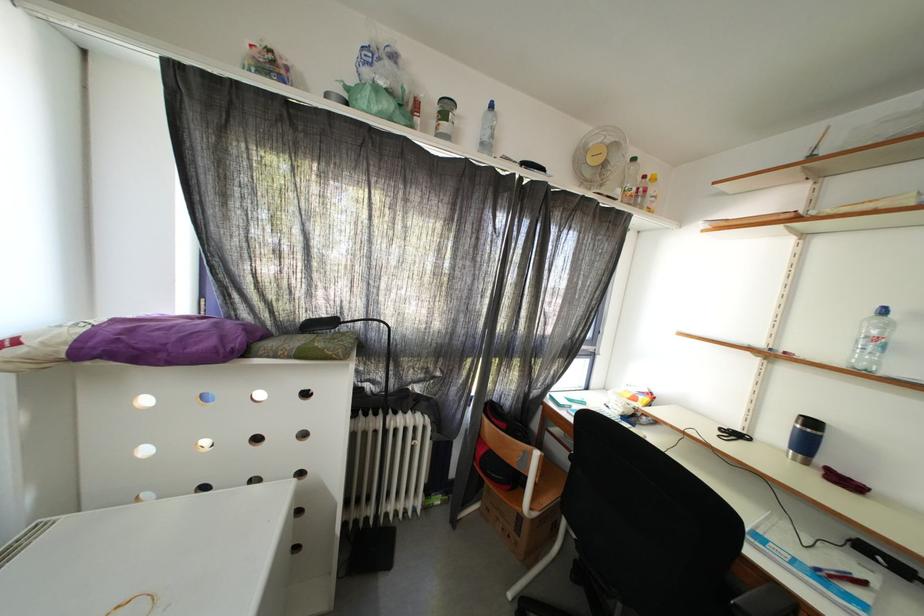
You are a GUI agent. You are given a task and a screenshot of the screen. Output one action in this format:
    pyautogui.click(x=<x>, y=<y>)
    Task: Click on the chair armrest
    
    Given the screenshot: What is the action you would take?
    pyautogui.click(x=736, y=588)